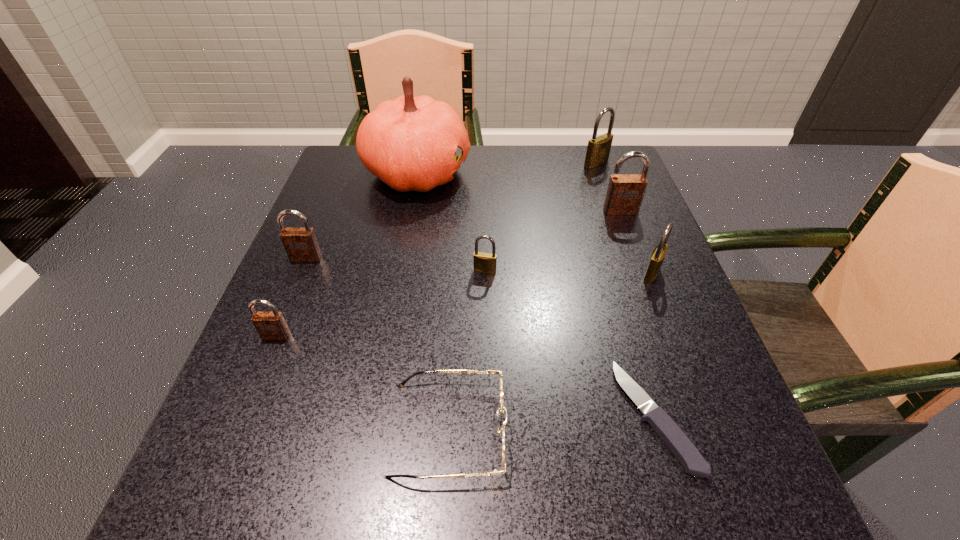
Image resolution: width=960 pixels, height=540 pixels. Identify the location of vacant space that satisfies the following two spatial constraints: 1. on the front-facing side of the second smallest brown padlock; 2. on the right side of the shortest object. (241, 416).

Identify the location of vacant space that satisfies the following two spatial constraints: 1. on the front side of the second smallest brass padlock; 2. on the lenses of the spectacles. (712, 429).

The height and width of the screenshot is (540, 960). In order to click on vacant space that satisfies the following two spatial constraints: 1. on the front-facing side of the rightmost brown padlock; 2. on the lenses of the green spectacles in this screenshot , I will do `click(702, 429)`.